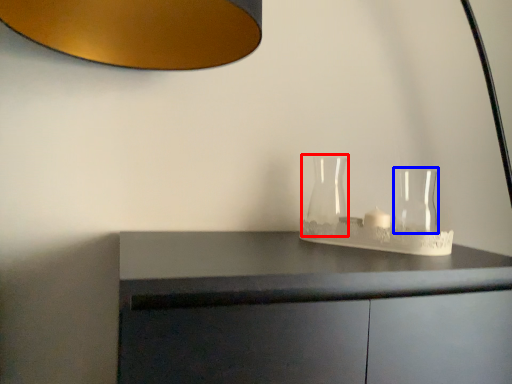
Question: Which point is closer to the camera, glass vase (highlighted by a red box) or glass vase (highlighted by a blue box)?

Choices:
 (A) glass vase
 (B) glass vase

Answer: (B)